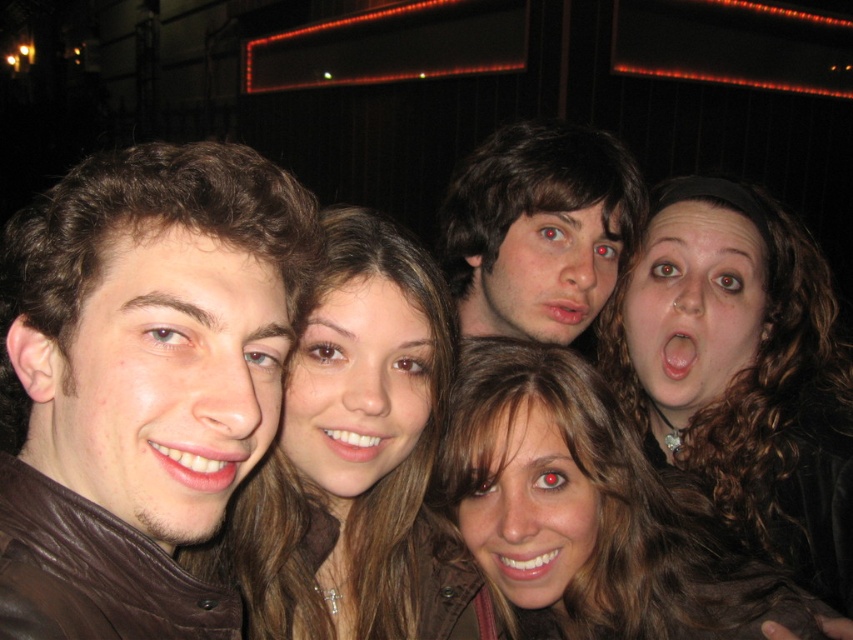
Question: Which point is closer to the camera?

Choices:
 (A) pink matte lips at center
 (B) matte brown hair at center
 (C) smooth skin face at center

Answer: (C)

Question: From the image, what is the correct spatial relationship of brown curly hair at upper right in relation to matte white teeth at lower left?

Choices:
 (A) below
 (B) above

Answer: (A)

Question: Which point appears closest to the camera in this image?

Choices:
 (A) pos(207,490)
 (B) pos(502,564)
 (C) pos(112,278)
 (D) pos(643,612)

Answer: (C)

Question: Considering the relative positions of smooth skin face at center and pink matte lips at center in the image provided, where is smooth skin face at center located with respect to pink matte lips at center?

Choices:
 (A) above
 (B) below

Answer: (B)

Question: Considering the relative positions of brown hair at center and matte white teeth at lower left in the image provided, where is brown hair at center located with respect to matte white teeth at lower left?

Choices:
 (A) right
 (B) left

Answer: (A)

Question: Considering the real-world distances, which object is farthest from the smooth skin face at center?

Choices:
 (A) brown leather jacket at left
 (B) white glossy teeth at center

Answer: (A)